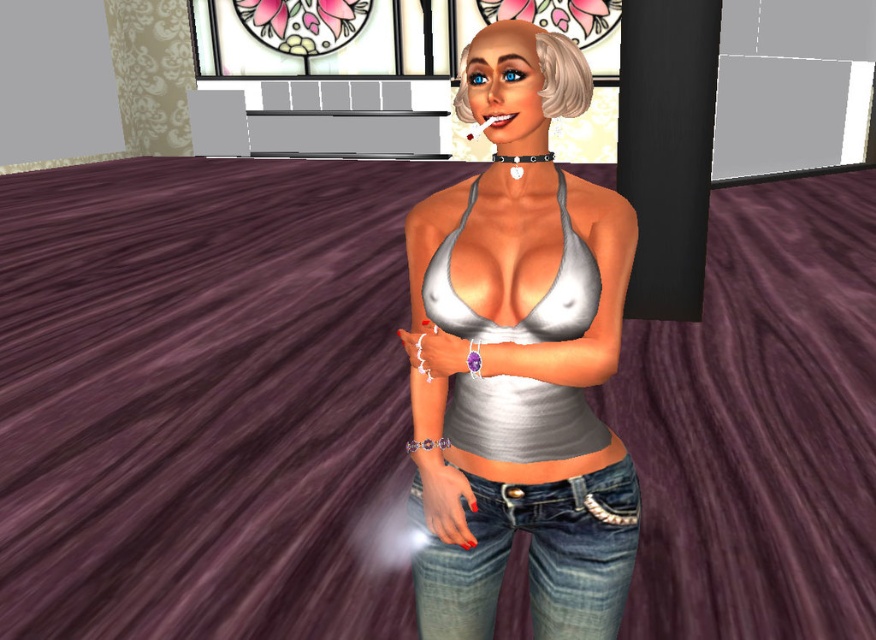
Question: Does silver metallic tank top at center have a larger size compared to denim jeans at center?

Choices:
 (A) yes
 (B) no

Answer: (A)

Question: Does denim jeans at center have a larger size compared to white matte bikini top at center?

Choices:
 (A) no
 (B) yes

Answer: (A)

Question: Does silver metallic tank top at center come in front of denim jeans at center?

Choices:
 (A) yes
 (B) no

Answer: (A)

Question: Which of these objects is positioned closest to the white matte bikini top at center?

Choices:
 (A) silver metallic tank top at center
 (B) denim jeans at center

Answer: (A)

Question: Which point is closer to the camera taking this photo?

Choices:
 (A) (599, 426)
 (B) (413, 484)
 (C) (451, 365)

Answer: (C)

Question: Which of these objects is positioned farthest from the silver metallic tank top at center?

Choices:
 (A) denim jeans at center
 (B) white matte bikini top at center

Answer: (A)